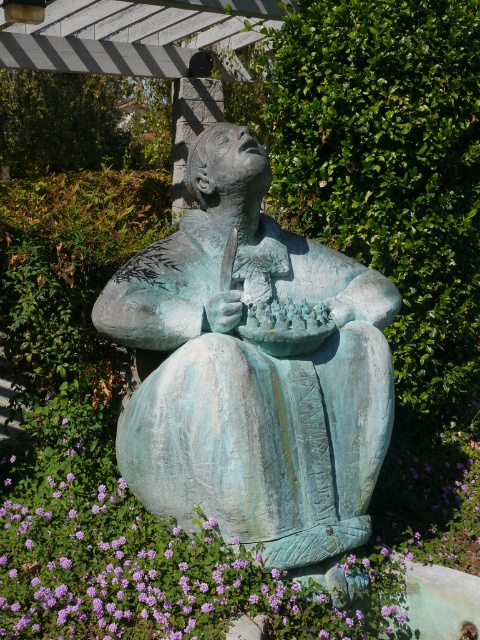
Which is above, green patina statue at center or purple matte flower at lower left?

green patina statue at center is above.

Which is more to the left, green patina statue at center or purple matte flower at lower left?

Positioned to the left is purple matte flower at lower left.

Find the location of a particular element. green patina statue at center is located at coordinates 253,369.

The width and height of the screenshot is (480, 640). What are the coordinates of `green patina statue at center` in the screenshot? It's located at (253, 369).